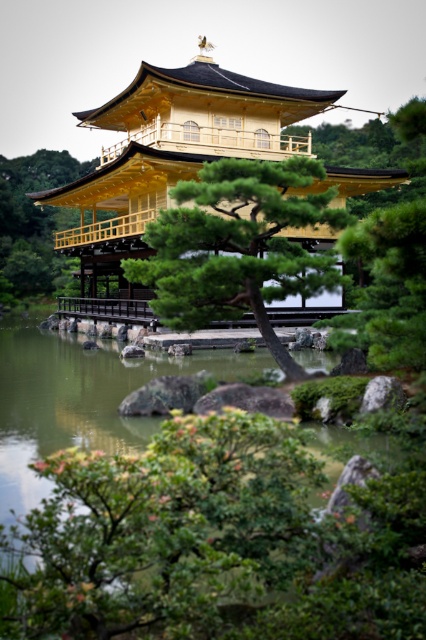
Question: Does gold polished wood palace at center appear over green textured pine tree at center?

Choices:
 (A) no
 (B) yes

Answer: (B)

Question: Is gold polished wood palace at center in front of green textured tree at center?

Choices:
 (A) yes
 (B) no

Answer: (A)

Question: Is green textured pine tree at center positioned at the back of green textured tree at center?

Choices:
 (A) no
 (B) yes

Answer: (A)

Question: Which point is farther to the camera?

Choices:
 (A) green textured tree at center
 (B) gold polished wood palace at center

Answer: (A)

Question: Which point is closer to the camera?

Choices:
 (A) green textured pine tree at center
 (B) green textured tree at center

Answer: (A)

Question: Estimate the real-world distances between objects in this image. Which object is closer to the green textured pine tree at center?

Choices:
 (A) gold polished wood palace at center
 (B) green textured tree at center

Answer: (A)